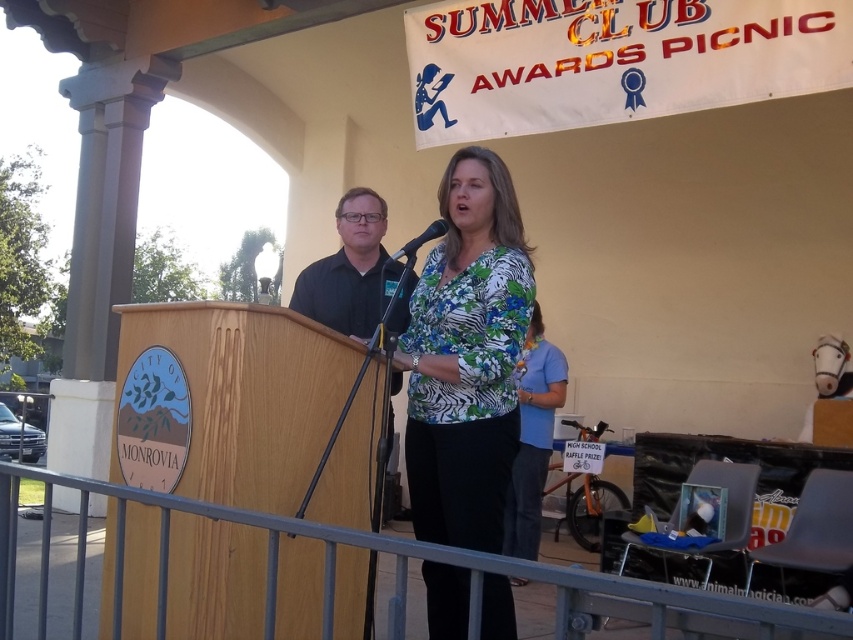
Which is below, floral print blouse at center or black smooth shirt at center?

Positioned lower is floral print blouse at center.

Does floral print blouse at center appear under black smooth shirt at center?

Yes.

Who is more distant from viewer, [505,320] or [355,252]?

Positioned behind is point [355,252].

In order to click on floral print blouse at center in this screenshot , I will do `click(466, 356)`.

Can you confirm if black smooth shirt at center is positioned below blue fabric shirt at center?

Actually, black smooth shirt at center is above blue fabric shirt at center.

Is black smooth shirt at center smaller than blue fabric shirt at center?

Actually, black smooth shirt at center might be larger than blue fabric shirt at center.

Is point (345, 237) closer to viewer compared to point (543, 403)?

Yes, point (345, 237) is in front of point (543, 403).

Image resolution: width=853 pixels, height=640 pixels. In order to click on black smooth shirt at center in this screenshot , I will do `click(355, 273)`.

Between blue fabric shirt at center and black plastic microphone at center, which one appears on the right side from the viewer's perspective?

blue fabric shirt at center is more to the right.

Who is more forward, (553, 344) or (416, 248)?

Point (416, 248) is more forward.

Where is `blue fabric shirt at center`? This screenshot has width=853, height=640. blue fabric shirt at center is located at coordinates (532, 438).